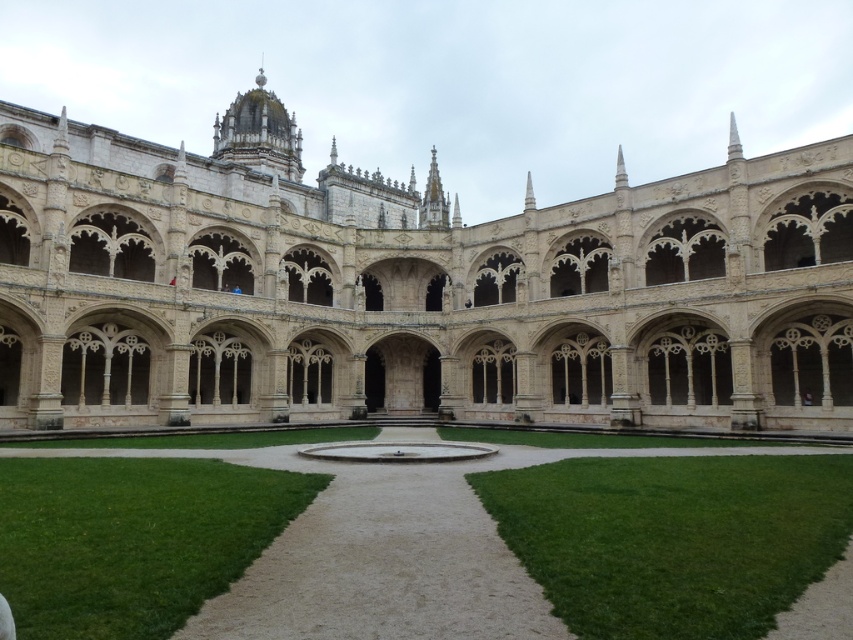
Question: Does white stone monastery at center appear on the right side of green grass at center?

Choices:
 (A) yes
 (B) no

Answer: (A)

Question: Can you confirm if white stone monastery at center is wider than green grass at center?

Choices:
 (A) no
 (B) yes

Answer: (B)

Question: Can you confirm if white stone monastery at center is positioned above green grass at center?

Choices:
 (A) yes
 (B) no

Answer: (A)

Question: Which object appears closest to the camera in this image?

Choices:
 (A) green grass at center
 (B) white stone monastery at center

Answer: (A)